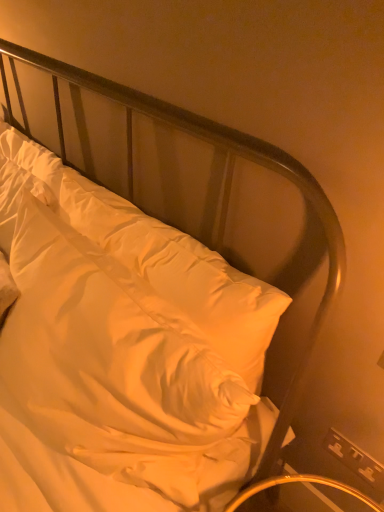
What do you see at coordinates (162, 259) in the screenshot? I see `white soft pillow at center` at bounding box center [162, 259].

Locate an element on the screen. white soft pillow at center is located at coordinates (162, 259).

This screenshot has height=512, width=384. Find the location of `white soft pillow at center`. white soft pillow at center is located at coordinates (162, 259).